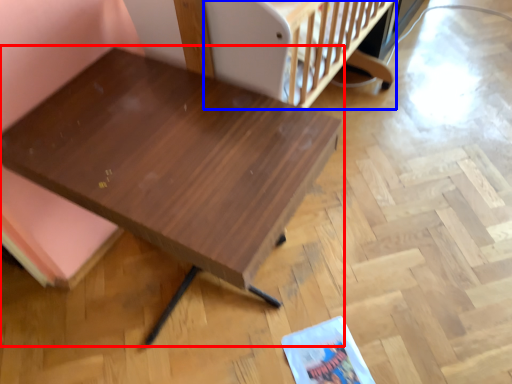
Question: Which point is further to the camera, table (highlighted by a red box) or infant bed (highlighted by a blue box)?

Choices:
 (A) table
 (B) infant bed

Answer: (B)